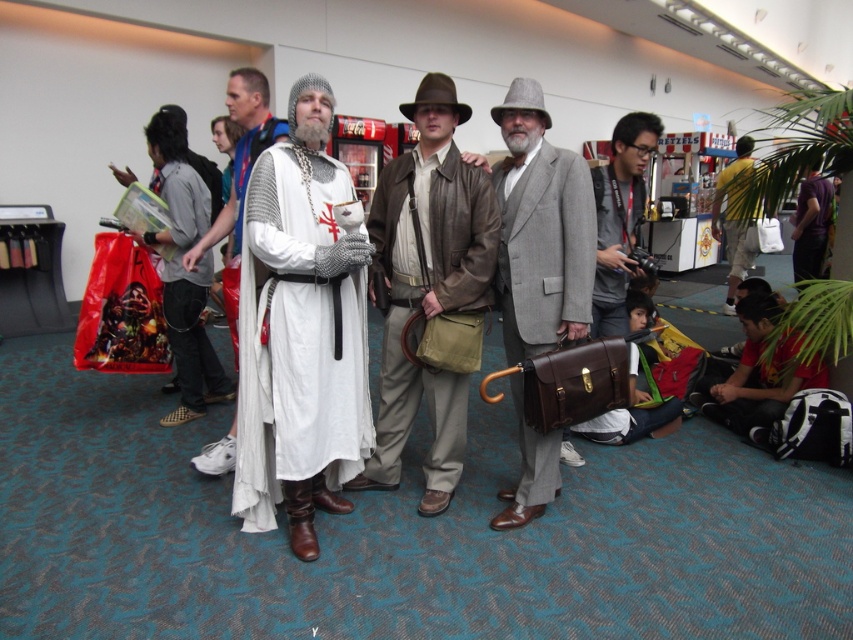
Does point (809, 168) come farther from viewer compared to point (735, 166)?

No, it is not.

Can you confirm if purple fabric shirt at right is positioned to the right of yellow fabric shirt at right?

Indeed, purple fabric shirt at right is positioned on the right side of yellow fabric shirt at right.

Is point (798, 221) positioned after point (746, 163)?

No, it is not.

Identify the location of purple fabric shirt at right. pos(811,224).

Is point (397, 257) positioned behind point (727, 278)?

No, it is not.

Does point (402, 205) come closer to viewer compared to point (724, 173)?

Yes, point (402, 205) is in front of point (724, 173).

You are a GUI agent. You are given a task and a screenshot of the screen. Output one action in this format:
    pyautogui.click(x=<x>, y=<y>)
    Task: Click on the matte brown leather jacket at center
    Image resolution: width=853 pixels, height=640 pixels.
    Given the screenshot: What is the action you would take?
    pyautogui.click(x=427, y=285)

Does white fabric cape at center appear on the left side of yellow fabric shirt at right?

Correct, you'll find white fabric cape at center to the left of yellow fabric shirt at right.

Can you confirm if white fabric cape at center is taller than yellow fabric shirt at right?

No, white fabric cape at center is not taller than yellow fabric shirt at right.

At what (x,y) coordinates should I click in order to perform the action: click on white fabric cape at center. Please return your answer as a coordinate pair (x, y). The height and width of the screenshot is (640, 853). Looking at the image, I should click on (297, 339).

This screenshot has height=640, width=853. In order to click on white fabric cape at center in this screenshot , I will do coord(297,339).